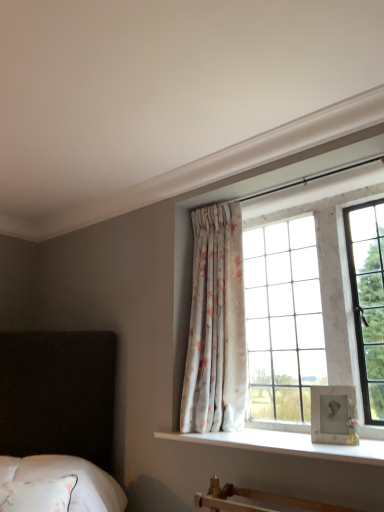
What is the approximate height of white soft bedding at lower left?

13.86 inches.

At what (x,y) coordinates should I click in order to perform the action: click on white smooth window sill at center. Please return your answer as a coordinate pair (x, y). The width and height of the screenshot is (384, 512). Looking at the image, I should click on (286, 444).

What do you see at coordinates (216, 325) in the screenshot? I see `floral fabric curtain at center` at bounding box center [216, 325].

This screenshot has height=512, width=384. Find the location of `white soft bedding at lower left`. white soft bedding at lower left is located at coordinates pyautogui.click(x=66, y=474).

Is floral fabric curtain at center aimed at white smooth window sill at center?

No, floral fabric curtain at center does not turn towards white smooth window sill at center.

Is white smooth window sill at center completely or partially inside floral fabric curtain at center?

No, white smooth window sill at center is not surrounded by floral fabric curtain at center.

At what (x,y) coordinates should I click in order to perform the action: click on curtain behind the white smooth window sill at center. Please return your answer as a coordinate pair (x, y). The height and width of the screenshot is (512, 384). Looking at the image, I should click on (216, 325).

How different are the orientations of floral fabric curtain at center and white smooth window sill at center in degrees?

The facing directions of floral fabric curtain at center and white smooth window sill at center are 0.00255 degrees apart.

Who is smaller, white textured glass at upper right or floral fabric curtain at center?

white textured glass at upper right.

Measure the distance between white textured glass at upper right and floral fabric curtain at center.

white textured glass at upper right and floral fabric curtain at center are 46.87 centimeters apart from each other.

Is the position of white textured glass at upper right more distant than that of floral fabric curtain at center?

No, white textured glass at upper right is closer to the camera.

Considering the sizes of objects white textured glass at upper right and floral fabric curtain at center in the image provided, who is thinner, white textured glass at upper right or floral fabric curtain at center?

With smaller width is white textured glass at upper right.

From the image's perspective, does white soft bedding at lower left appear higher than floral fabric curtain at center?

Incorrect, from the image's perspective, white soft bedding at lower left is lower than floral fabric curtain at center.

In the scene shown: Is white soft bedding at lower left surrounding floral fabric curtain at center?

No, floral fabric curtain at center is located outside of white soft bedding at lower left.

In terms of size, does white soft bedding at lower left appear bigger or smaller than floral fabric curtain at center?

Clearly, white soft bedding at lower left is smaller in size than floral fabric curtain at center.

Is white soft bedding at lower left placed right next to floral fabric curtain at center?

No, white soft bedding at lower left is not next to floral fabric curtain at center.

From the image's perspective, which is below, floral fabric curtain at center or white textured glass at upper right?

floral fabric curtain at center appears lower in the image.

Is white textured glass at upper right completely or partially inside floral fabric curtain at center?

No.

Consider the image. Considering the sizes of objects floral fabric curtain at center and white textured glass at upper right in the image provided, who is shorter, floral fabric curtain at center or white textured glass at upper right?

white textured glass at upper right.

Considering the relative sizes of floral fabric curtain at center and white textured glass at upper right in the image provided, is floral fabric curtain at center thinner than white textured glass at upper right?

No, floral fabric curtain at center is not thinner than white textured glass at upper right.

Is white smooth window sill at center to the right of floral fabric curtain at center from the viewer's perspective?

Yes.

From a real-world perspective, is white smooth window sill at center physically located above or below floral fabric curtain at center?

white smooth window sill at center is situated lower than floral fabric curtain at center in the real world.

Looking at this image, is white smooth window sill at center surrounding floral fabric curtain at center?

No, white smooth window sill at center does not contain floral fabric curtain at center.

Is white smooth window sill at center facing towards floral fabric curtain at center?

No, white smooth window sill at center is not turned towards floral fabric curtain at center.

Considering the sizes of objects white soft bedding at lower left and white smooth window sill at center in the image provided, who is shorter, white soft bedding at lower left or white smooth window sill at center?

With less height is white smooth window sill at center.

Between white soft bedding at lower left and white smooth window sill at center, which one has larger width?

Wider between the two is white soft bedding at lower left.

From a real-world perspective, who is located lower, white soft bedding at lower left or white smooth window sill at center?

In real-world perspective, white soft bedding at lower left is lower.

Does white textured glass at upper right have a larger size compared to white smooth window sill at center?

Correct, white textured glass at upper right is larger in size than white smooth window sill at center.

Between white textured glass at upper right and white smooth window sill at center, which one is positioned behind?

white textured glass at upper right.

Are white textured glass at upper right and white smooth window sill at center far apart?

That's not correct — white textured glass at upper right is a little close to white smooth window sill at center.

From a real-world perspective, between white textured glass at upper right and white smooth window sill at center, who is vertically higher?

white textured glass at upper right, from a real-world perspective.

Locate an element on the screen. This screenshot has height=512, width=384. curtain behind the white smooth window sill at center is located at coordinates (216, 325).

The height and width of the screenshot is (512, 384). What are the coordinates of `bay window above the floral fabric curtain at center (from the image's perspective)` in the screenshot? It's located at [x=328, y=258].

Looking at the image, which one is located further to floral fabric curtain at center, white soft bedding at lower left or white textured glass at upper right?

white soft bedding at lower left lies further to floral fabric curtain at center than the other object.

Estimate the real-world distances between objects in this image. Which object is closer to white soft bedding at lower left, floral fabric curtain at center or white textured glass at upper right?

floral fabric curtain at center lies closer to white soft bedding at lower left than the other object.

Estimate the real-world distances between objects in this image. Which object is closer to white soft bedding at lower left, floral fabric curtain at center or white smooth window sill at center?

white smooth window sill at center lies closer to white soft bedding at lower left than the other object.

Looking at the image, which one is located closer to floral fabric curtain at center, white textured glass at upper right or white soft bedding at lower left?

white textured glass at upper right.

From the image, which object appears to be farther from white textured glass at upper right, white soft bedding at lower left or floral fabric curtain at center?

Based on the image, white soft bedding at lower left appears to be further to white textured glass at upper right.

Based on their spatial positions, is white textured glass at upper right or floral fabric curtain at center further from white soft bedding at lower left?

white textured glass at upper right.

Considering their positions, is white smooth window sill at center positioned further to white textured glass at upper right than white soft bedding at lower left?

white soft bedding at lower left is positioned further to the anchor white textured glass at upper right.

Which object lies nearer to the anchor point white smooth window sill at center, white soft bedding at lower left or floral fabric curtain at center?

The object closer to white smooth window sill at center is floral fabric curtain at center.

Image resolution: width=384 pixels, height=512 pixels. I want to click on curtain between white soft bedding at lower left and white textured glass at upper right from left to right, so click(216, 325).

You are a GUI agent. You are given a task and a screenshot of the screen. Output one action in this format:
    pyautogui.click(x=<x>, y=<y>)
    Task: Click on the curtain between white textured glass at upper right and white smooth window sill at center in the up-down direction
    The width and height of the screenshot is (384, 512).
    Given the screenshot: What is the action you would take?
    pyautogui.click(x=216, y=325)

Identify the location of window sill between white soft bedding at lower left and white textured glass at upper right in the horizontal direction. This screenshot has width=384, height=512. (286, 444).

Find the location of a particular element. This screenshot has width=384, height=512. curtain located between white soft bedding at lower left and white smooth window sill at center in the left-right direction is located at coordinates (216, 325).